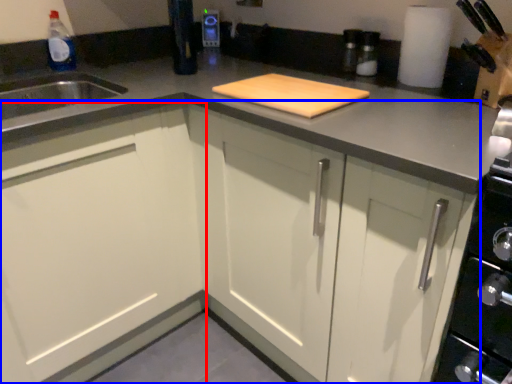
Question: Which object appears farthest to the camera in this image, cabinetry (highlighted by a red box) or cabinetry (highlighted by a blue box)?

Choices:
 (A) cabinetry
 (B) cabinetry

Answer: (A)